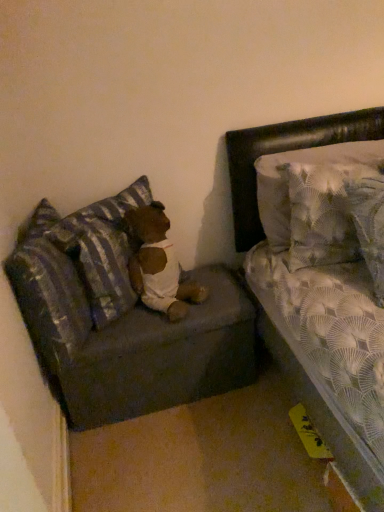
Identify the location of free spot in front of dark gray fabric couch at lower left. (179, 456).